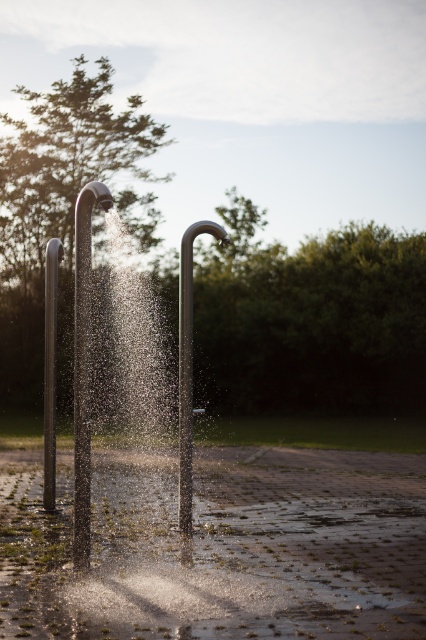
Question: Which object is positioned farthest from the polished stainless steel shower head at center?

Choices:
 (A) satin silver pole at left
 (B) satin silver shower head at center

Answer: (A)

Question: From the image, what is the correct spatial relationship of satin silver shower head at center in relation to polished stainless steel shower head at center?

Choices:
 (A) above
 (B) below

Answer: (A)

Question: Which of these objects is positioned closest to the satin silver shower head at center?

Choices:
 (A) polished stainless steel shower head at center
 (B) satin silver pole at left

Answer: (A)

Question: Among these points, which one is nearest to the camera?

Choices:
 (A) [x=77, y=400]
 (B) [x=54, y=269]
 (C) [x=181, y=509]

Answer: (A)

Question: Can you confirm if satin silver shower head at center is positioned above polished stainless steel shower head at center?

Choices:
 (A) no
 (B) yes

Answer: (B)

Question: Can you confirm if polished stainless steel shower head at center is positioned to the right of satin silver pole at left?

Choices:
 (A) yes
 (B) no

Answer: (A)